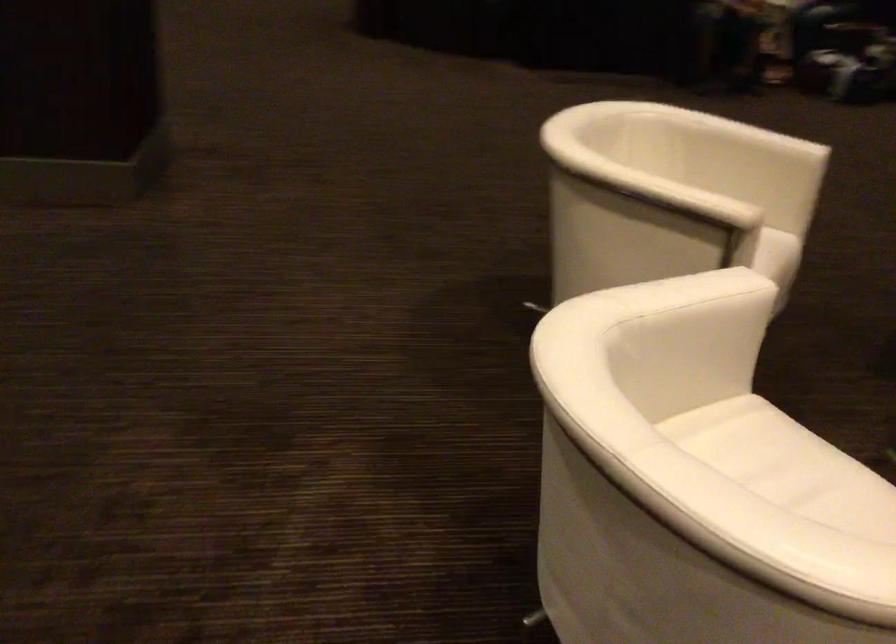
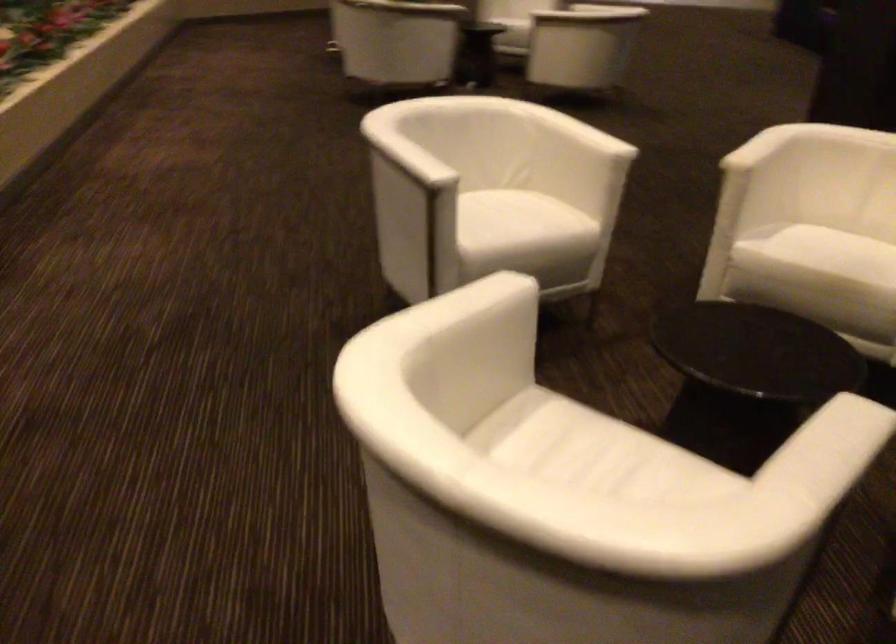
The point at (764, 249) is marked in the first image. Where is the corresponding point in the second image?

(836, 252)